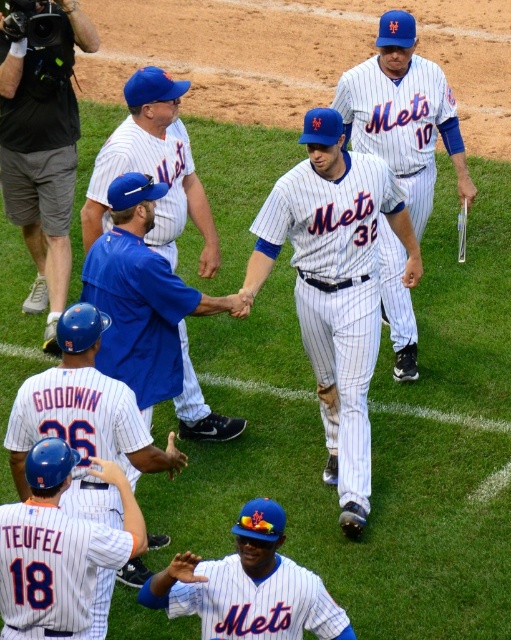
The width and height of the screenshot is (511, 640). Describe the element at coordinates (149, 310) in the screenshot. I see `blue fabric shirt at center` at that location.

Which is in front, point (122, 300) or point (142, 532)?

Point (142, 532) is more forward.

Where is `blue fabric shirt at center`? blue fabric shirt at center is located at coordinates (149, 310).

Can you confirm if white pinstriped jersey at center is positioned below white pinstriped uniform at center?

Indeed, white pinstriped jersey at center is positioned under white pinstriped uniform at center.

Between point (330, 324) and point (412, 340), which one is positioned behind?

The point (412, 340) is more distant.

Find the location of a particular element. Image resolution: width=511 pixels, height=640 pixels. white pinstriped jersey at center is located at coordinates (336, 292).

Does blue matte helmet at upper left have a greater width compared to white pinstriped uniform at center?

No, blue matte helmet at upper left is not wider than white pinstriped uniform at center.

The height and width of the screenshot is (640, 511). Describe the element at coordinates (41, 141) in the screenshot. I see `blue matte helmet at upper left` at that location.

Locate an element on the screen. Image resolution: width=511 pixels, height=640 pixels. blue matte helmet at upper left is located at coordinates (41, 141).